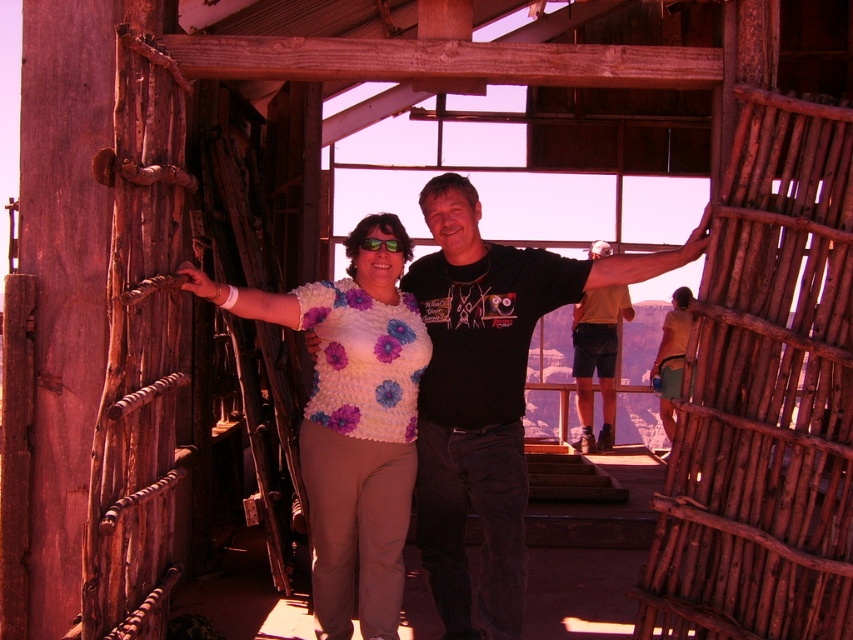
Which is more to the left, white floral blouse at center or brown fabric shirt at right?

white floral blouse at center is more to the left.

Can you confirm if white floral blouse at center is positioned to the left of brown fabric shirt at right?

Correct, you'll find white floral blouse at center to the left of brown fabric shirt at right.

Is point (451, 499) positioned after point (677, 323)?

That is False.

Image resolution: width=853 pixels, height=640 pixels. In order to click on white floral blouse at center in this screenshot , I will do `click(488, 394)`.

Does white fabric at center appear under green reflective lenses at center?

Indeed, white fabric at center is positioned under green reflective lenses at center.

Is white fabric at center above green reflective lenses at center?

Incorrect, white fabric at center is not positioned above green reflective lenses at center.

The width and height of the screenshot is (853, 640). What do you see at coordinates (245, 300) in the screenshot?
I see `white fabric at center` at bounding box center [245, 300].

Locate an element on the screen. This screenshot has height=640, width=853. white fabric at center is located at coordinates (245, 300).

Does brown fabric shirt at right have a greater width compared to green reflective lenses at center?

Yes, brown fabric shirt at right is wider than green reflective lenses at center.

How much distance is there between brown fabric shirt at right and green reflective lenses at center?

brown fabric shirt at right is 11.15 meters away from green reflective lenses at center.

Is point (682, 364) behind point (395, 250)?

Yes, point (682, 364) is behind point (395, 250).

I want to click on brown fabric shirt at right, so [x=671, y=356].